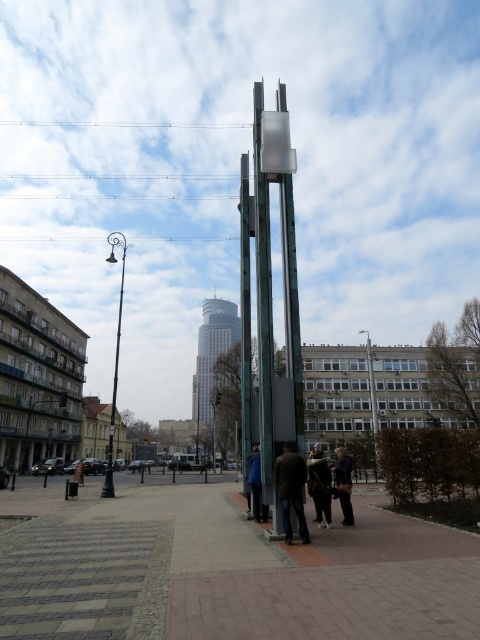
Question: From the image, what is the correct spatial relationship of polished metal streetlight at left in relation to dark brown fur coat at lower center?

Choices:
 (A) left
 (B) right

Answer: (A)

Question: Which object appears farthest from the camera in this image?

Choices:
 (A) dark brown fur coat at lower center
 (B) polished metal streetlight at left

Answer: (B)

Question: Which point is farther to the camera?

Choices:
 (A) brick pavement at center
 (B) dark purple jacket at lower right

Answer: (B)

Question: Does dark brown leather jacket at center have a lesser width compared to blue denim jacket at center?

Choices:
 (A) no
 (B) yes

Answer: (A)

Question: Can you confirm if polished metal streetlight at left is positioned to the left of dark brown fur coat at lower center?

Choices:
 (A) yes
 (B) no

Answer: (A)

Question: Considering the real-world distances, which object is closest to the brick pavement at center?

Choices:
 (A) polished metal streetlight at left
 (B) dark brown fur coat at lower center
 (C) glassy silver skyscraper at center
 (D) dark purple jacket at lower right

Answer: (D)